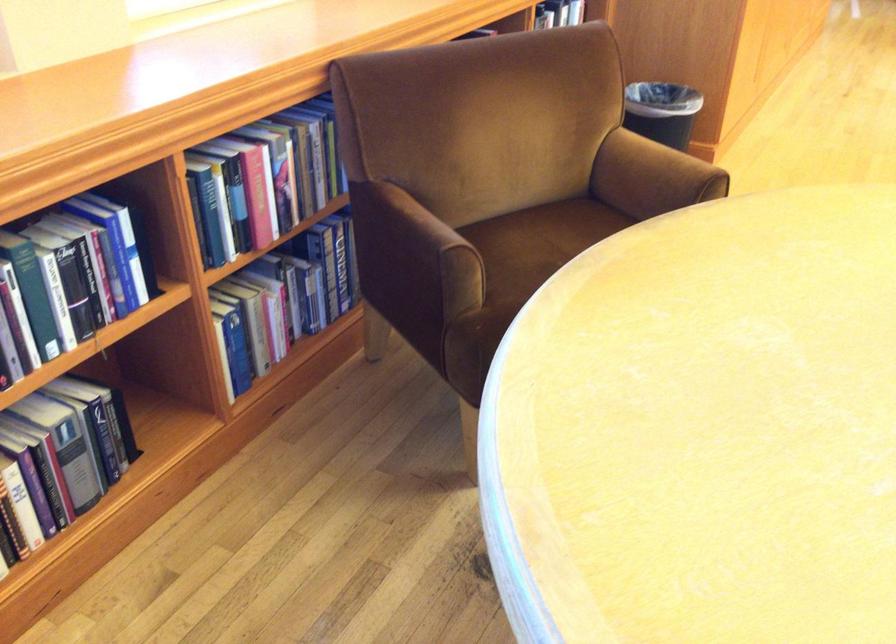
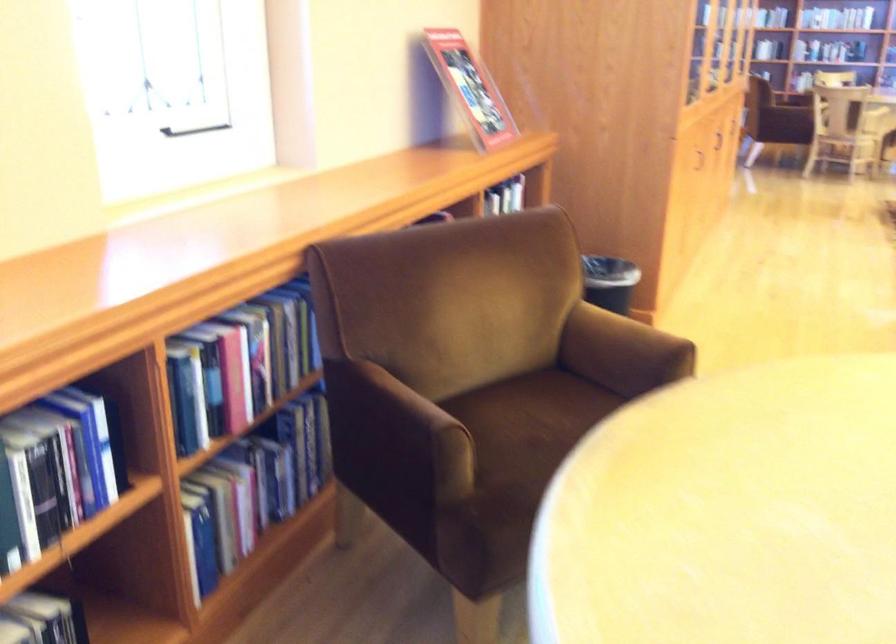
In the second image, find the point that corresponds to (553,250) in the first image.

(535, 426)